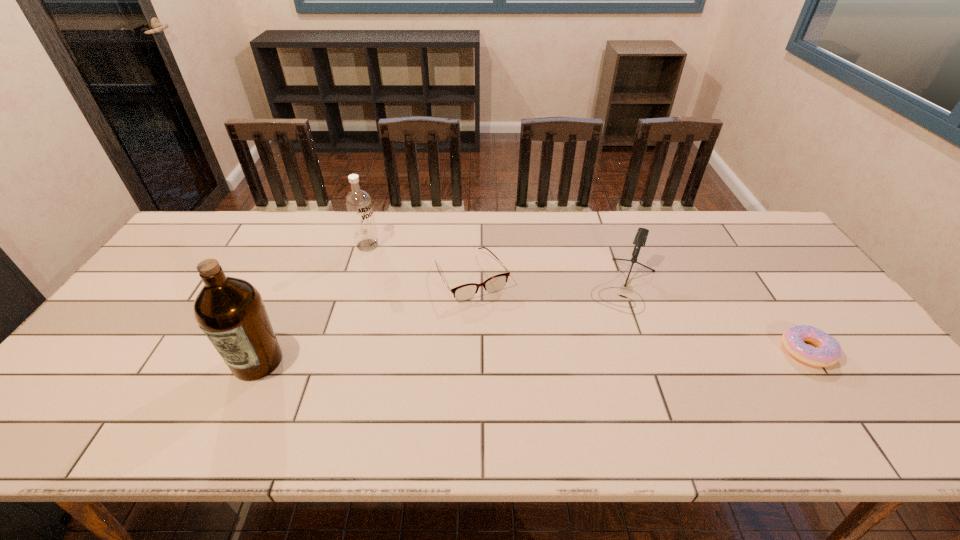
I want to click on the tallest object, so click(x=230, y=311).

Identify the location of the leftmost object. This screenshot has height=540, width=960. [x=230, y=311].

At what (x,y) coordinates should I click in order to perform the action: click on the rightmost object. Please return your answer as a coordinate pair (x, y). Looking at the image, I should click on coord(827,352).

The width and height of the screenshot is (960, 540). What are the coordinates of `doughnut` in the screenshot? It's located at (827, 352).

Identify the location of microphone. Image resolution: width=960 pixels, height=540 pixels. (641, 236).

Locate an element on the screen. the fourth object from left to right is located at coordinates (641, 236).

Locate an element on the screen. Image resolution: width=960 pixels, height=540 pixels. spectacles is located at coordinates (465, 292).

This screenshot has height=540, width=960. I want to click on the second shortest object, so click(x=465, y=292).

At what (x,y) coordinates should I click in order to perform the action: click on the second object from left to right. Please return your answer as a coordinate pair (x, y). Looking at the image, I should click on (358, 202).

You are a GUI agent. You are given a task and a screenshot of the screen. Output one action in this format:
    pyautogui.click(x=<x>, y=<y>)
    Task: Click on the second tallest object
    The image size is (960, 540).
    Given the screenshot: What is the action you would take?
    pyautogui.click(x=358, y=202)